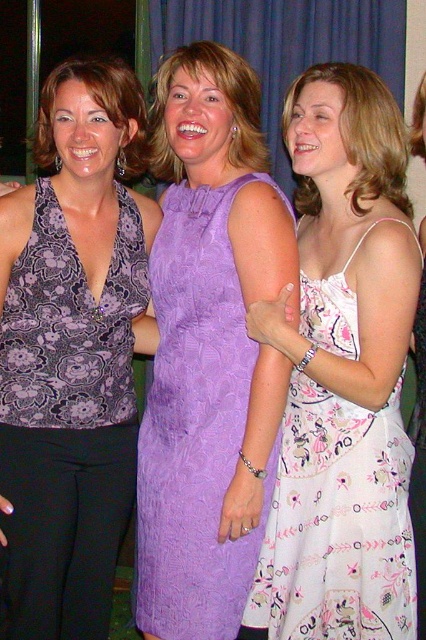
Question: Can you confirm if matte floral top at left is positioned above purple fabric curtain at upper center?

Choices:
 (A) yes
 (B) no

Answer: (B)

Question: Does pink lace dress at center appear on the right side of purple satin dress at center?

Choices:
 (A) no
 (B) yes

Answer: (B)

Question: Is lavender lace dress at center positioned in front of pink lace dress at center?

Choices:
 (A) yes
 (B) no

Answer: (B)

Question: Which object is the closest to the white floral dress at center?

Choices:
 (A) matte floral top at left
 (B) purple satin dress at center
 (C) purple fabric curtain at upper center

Answer: (A)

Question: Which of the following is the closest to the observer?

Choices:
 (A) (317, 625)
 (B) (115, 99)
 (C) (74, 193)
 (D) (359, 8)

Answer: (A)

Question: Estimate the real-world distances between objects in this image. Which object is closer to the pink lace dress at center?

Choices:
 (A) lavender lace dress at center
 (B) matte purple dress at center

Answer: (A)